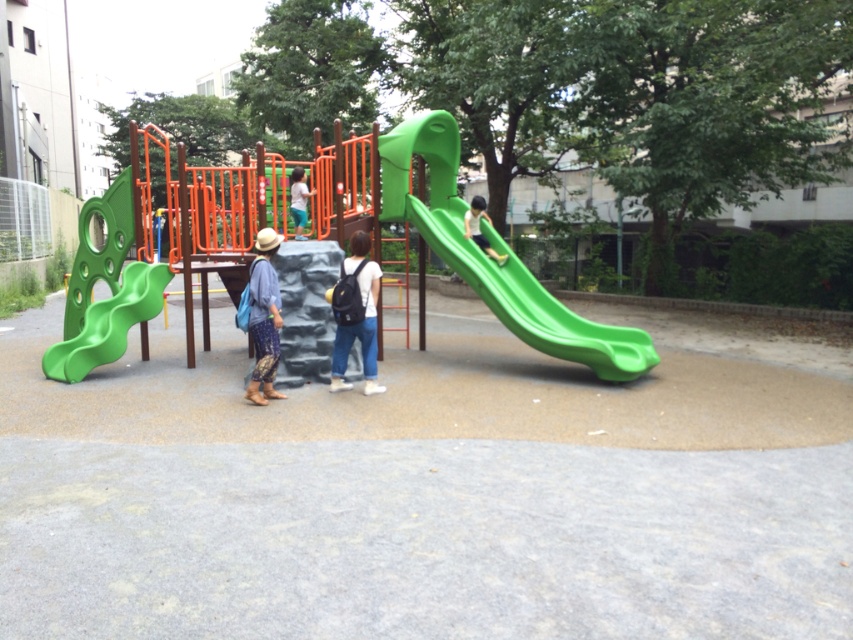
Question: Is green matte slide at left wider than matte green slide at center?

Choices:
 (A) no
 (B) yes

Answer: (B)

Question: Is green matte slide at left closer to camera compared to blue fabric bag at center?

Choices:
 (A) no
 (B) yes

Answer: (A)

Question: Which object appears farthest from the camera in this image?

Choices:
 (A) black fabric backpack at center
 (B) matte green slide at center

Answer: (B)

Question: Which point is closer to the camera?

Choices:
 (A) black fabric backpack at center
 (B) green plastic slide at center
 (C) blue fabric bag at center
 (D) matte green slide at center

Answer: (C)

Question: Among these objects, which one is nearest to the camera?

Choices:
 (A) green plastic slide at center
 (B) matte green slide at center
 (C) blue fabric bag at center

Answer: (C)

Question: Is black fabric backpack at center further to the viewer compared to green matte slide at right?

Choices:
 (A) yes
 (B) no

Answer: (B)